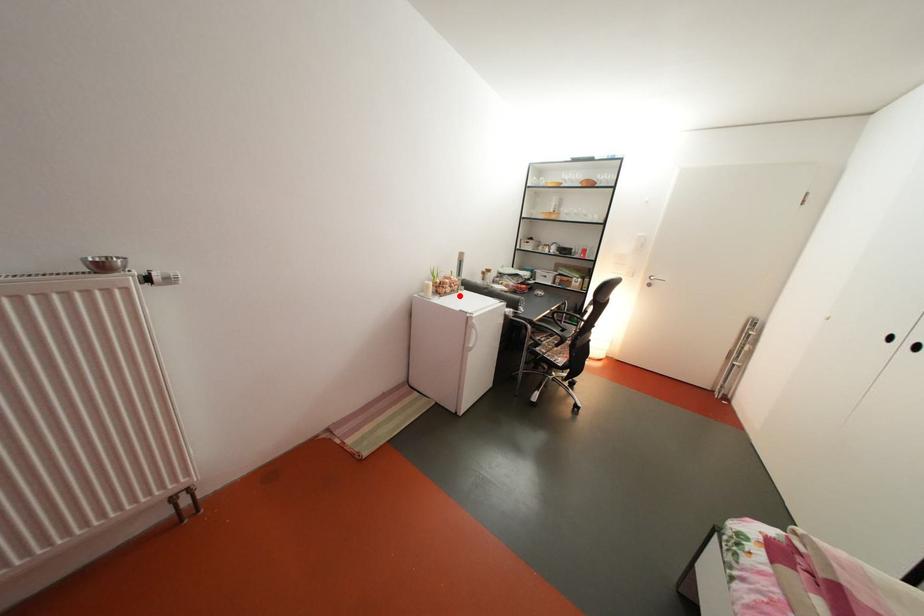
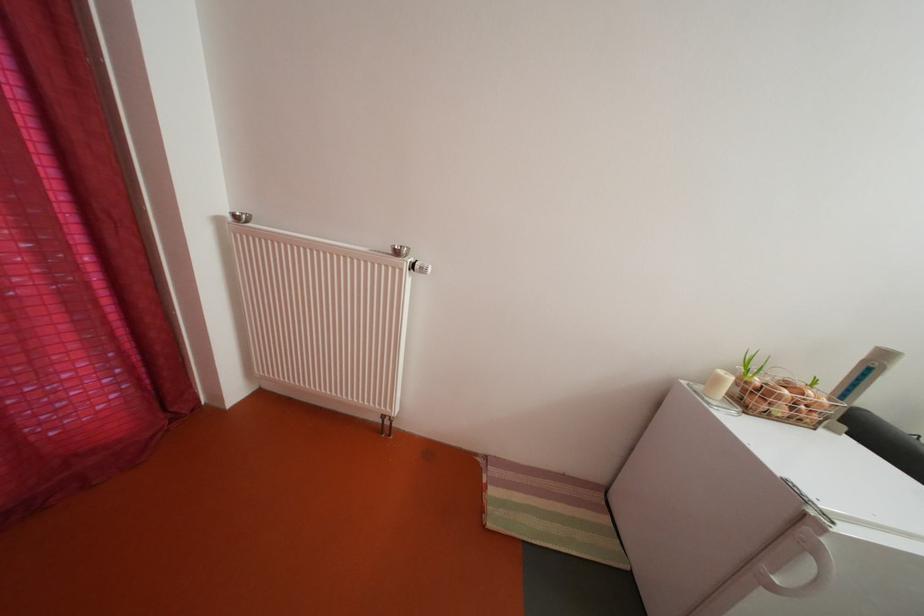
Where in the second image is the point corresponding to the highlighted location from the first image?

(792, 416)